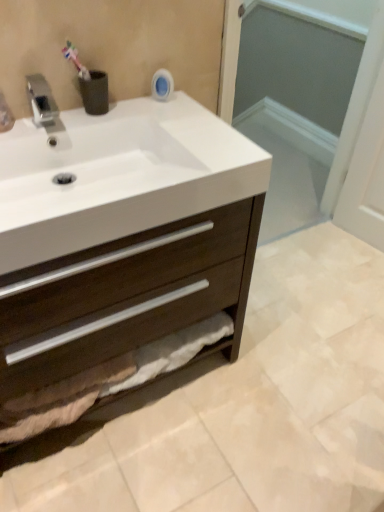
Describe the element at coordinates (127, 309) in the screenshot. I see `dark wood cabinet at center` at that location.

Find the location of a particular element. This screenshot has width=384, height=512. white glossy sink at upper left is located at coordinates (118, 176).

Image resolution: width=384 pixels, height=512 pixels. I want to click on transparent glass screen door at upper center, so click(x=290, y=99).

At what (x,y) coordinates should I click in order to perform the action: click on dark wood cabinet at center. Please return your answer as a coordinate pair (x, y). The height and width of the screenshot is (512, 384). Looking at the image, I should click on (127, 309).

From the image's perspective, would you say white glossy sink at upper left is shown under transparent glass screen door at upper center?

→ Yes, from the image's perspective, white glossy sink at upper left is beneath transparent glass screen door at upper center.

Which object is further away from the camera, white glossy sink at upper left or transparent glass screen door at upper center?

transparent glass screen door at upper center is behind.

From a real-world perspective, which is physically below, white glossy sink at upper left or transparent glass screen door at upper center?

transparent glass screen door at upper center, from a real-world perspective.

Is white glossy sink at upper left wider or thinner than transparent glass screen door at upper center?

Considering their sizes, white glossy sink at upper left looks broader than transparent glass screen door at upper center.

The image size is (384, 512). I want to click on bathroom cabinet that is below the transparent glass screen door at upper center (from the image's perspective), so click(x=127, y=309).

Who is taller, transparent glass screen door at upper center or dark wood cabinet at center?

transparent glass screen door at upper center is taller.

How much distance is there between transparent glass screen door at upper center and dark wood cabinet at center?

The distance of transparent glass screen door at upper center from dark wood cabinet at center is 1.34 meters.

Are transparent glass screen door at upper center and dark wood cabinet at center located far from each other?

That's right, there is a large distance between transparent glass screen door at upper center and dark wood cabinet at center.

Between point (237, 172) and point (35, 80), which one is positioned in front?

Positioned in front is point (237, 172).

From a real-world perspective, does white glossy sink at upper left sit lower than silver metallic faucet at upper left?

Correct, in the physical world, white glossy sink at upper left is lower than silver metallic faucet at upper left.

Does white glossy sink at upper left appear on the left side of silver metallic faucet at upper left?

No.

From the image's perspective, which is below, white glossy sink at upper left or silver metallic faucet at upper left?

white glossy sink at upper left.

Does transparent glass screen door at upper center turn towards white glossy sink at upper left?

No, transparent glass screen door at upper center does not turn towards white glossy sink at upper left.

From a real-world perspective, is transparent glass screen door at upper center below white glossy sink at upper left?

Yes, from a real-world perspective, transparent glass screen door at upper center is under white glossy sink at upper left.

At what (x,y) coordinates should I click in order to perform the action: click on screen door located above the white glossy sink at upper left (from the image's perspective). Please return your answer as a coordinate pair (x, y). This screenshot has width=384, height=512. Looking at the image, I should click on (290, 99).

Is transparent glass screen door at upper center behind white glossy sink at upper left?

Yes, the depth of transparent glass screen door at upper center is greater than that of white glossy sink at upper left.

From the image's perspective, which object appears higher, dark wood cabinet at center or silver metallic faucet at upper left?

silver metallic faucet at upper left is shown above in the image.

Can you confirm if dark wood cabinet at center is bigger than silver metallic faucet at upper left?

Yes, dark wood cabinet at center is bigger than silver metallic faucet at upper left.

From a real-world perspective, is dark wood cabinet at center positioned above or below silver metallic faucet at upper left?

From a real-world perspective, dark wood cabinet at center is physically below silver metallic faucet at upper left.

Which is nearer, (209,288) or (39,101)?

The point (39,101) is closer.

Considering the positions of objects dark wood cabinet at center and transparent glass screen door at upper center in the image provided, who is behind, dark wood cabinet at center or transparent glass screen door at upper center?

Positioned behind is transparent glass screen door at upper center.

Does dark wood cabinet at center appear on the right side of transparent glass screen door at upper center?

In fact, dark wood cabinet at center is to the left of transparent glass screen door at upper center.

How distant is dark wood cabinet at center from transparent glass screen door at upper center?

The distance of dark wood cabinet at center from transparent glass screen door at upper center is 4.41 feet.

Between dark wood cabinet at center and transparent glass screen door at upper center, which one has less height?

dark wood cabinet at center is shorter.

Is silver metallic faucet at upper left inside or outside of transparent glass screen door at upper center?

silver metallic faucet at upper left is not enclosed by transparent glass screen door at upper center.

From the image's perspective, relative to transparent glass screen door at upper center, is silver metallic faucet at upper left above or below?

silver metallic faucet at upper left is situated lower than transparent glass screen door at upper center in the image.

Measure the distance from silver metallic faucet at upper left to transparent glass screen door at upper center.

They are 1.85 meters apart.

Consider the image. From a real-world perspective, between silver metallic faucet at upper left and transparent glass screen door at upper center, who is vertically higher?

silver metallic faucet at upper left is physically above.

The height and width of the screenshot is (512, 384). What are the coordinates of `sink in front of the transparent glass screen door at upper center` in the screenshot? It's located at (118, 176).

Where is `screen door on the right of dark wood cabinet at center`? screen door on the right of dark wood cabinet at center is located at coordinates click(290, 99).

Estimate the real-world distances between objects in this image. Which object is further from dark wood cabinet at center, white glossy sink at upper left or silver metallic faucet at upper left?

silver metallic faucet at upper left is further to dark wood cabinet at center.

Looking at the image, which one is located closer to transparent glass screen door at upper center, silver metallic faucet at upper left or dark wood cabinet at center?

The object closer to transparent glass screen door at upper center is dark wood cabinet at center.

Considering their positions, is transparent glass screen door at upper center positioned closer to white glossy sink at upper left than dark wood cabinet at center?

dark wood cabinet at center.

Based on their spatial positions, is transparent glass screen door at upper center or silver metallic faucet at upper left closer to dark wood cabinet at center?

silver metallic faucet at upper left.

Based on their spatial positions, is dark wood cabinet at center or silver metallic faucet at upper left further from white glossy sink at upper left?

silver metallic faucet at upper left is positioned further to the anchor white glossy sink at upper left.

Based on their spatial positions, is white glossy sink at upper left or silver metallic faucet at upper left closer to transparent glass screen door at upper center?

white glossy sink at upper left.

Based on their spatial positions, is white glossy sink at upper left or transparent glass screen door at upper center further from silver metallic faucet at upper left?

transparent glass screen door at upper center is further to silver metallic faucet at upper left.

Estimate the real-world distances between objects in this image. Which object is closer to transparent glass screen door at upper center, dark wood cabinet at center or white glossy sink at upper left?

The object closer to transparent glass screen door at upper center is dark wood cabinet at center.

Identify the location of sink situated between dark wood cabinet at center and transparent glass screen door at upper center from left to right. (118, 176).

Locate an element on the screen. sink between silver metallic faucet at upper left and transparent glass screen door at upper center in the horizontal direction is located at coordinates (118, 176).

Image resolution: width=384 pixels, height=512 pixels. Find the location of `sink that lies between silver metallic faucet at upper left and dark wood cabinet at center from top to bottom`. sink that lies between silver metallic faucet at upper left and dark wood cabinet at center from top to bottom is located at coordinates (118, 176).

Where is `bathroom cabinet situated between silver metallic faucet at upper left and transparent glass screen door at upper center from left to right`? This screenshot has height=512, width=384. bathroom cabinet situated between silver metallic faucet at upper left and transparent glass screen door at upper center from left to right is located at coordinates (127, 309).